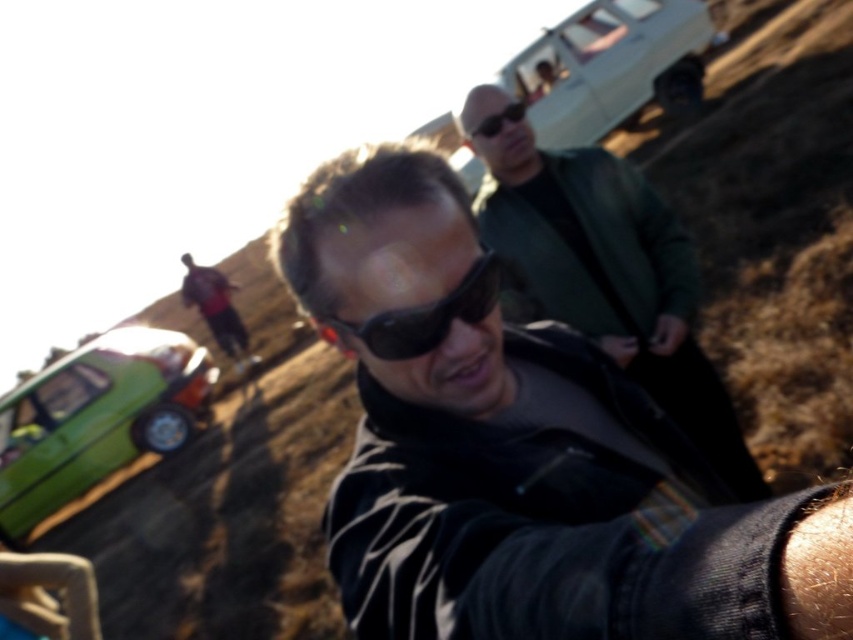
Question: Considering the real-world distances, which object is closest to the black matte sunglasses at center?

Choices:
 (A) red shirt at center
 (B) white matte van at upper center

Answer: (B)

Question: Is dark green leather jacket at upper center positioned before black reflective sunglasses at center?

Choices:
 (A) yes
 (B) no

Answer: (B)

Question: Can you confirm if black reflective sunglasses at center is positioned above red shirt at center?

Choices:
 (A) no
 (B) yes

Answer: (A)

Question: Which object appears farthest from the camera in this image?

Choices:
 (A) green matte car at lower left
 (B) white matte van at upper center

Answer: (A)

Question: Among these objects, which one is farthest from the camera?

Choices:
 (A) dark green leather jacket at upper center
 (B) black matte sunglasses at upper center

Answer: (B)

Question: Is green matte car at lower left smaller than red shirt at center?

Choices:
 (A) yes
 (B) no

Answer: (B)